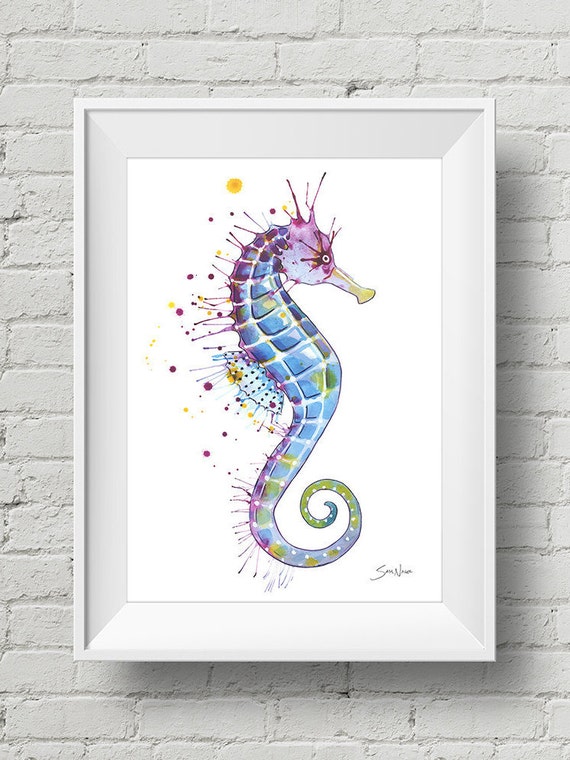
Image resolution: width=570 pixels, height=760 pixels. What are the coordinates of `brick wall` in the screenshot? It's located at (538, 527).